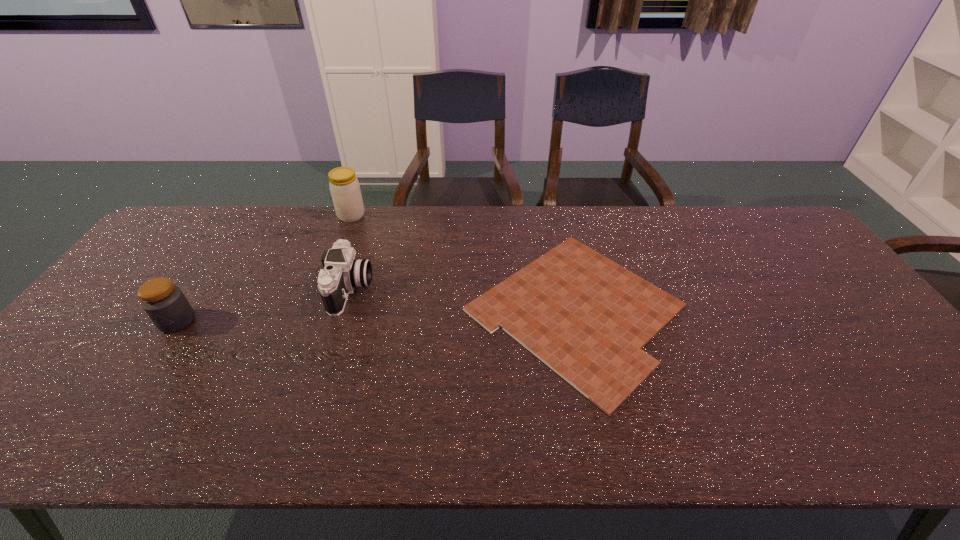
This screenshot has height=540, width=960. In order to click on the farthest object in this screenshot , I will do `click(345, 190)`.

Where is `the right jar`? The height and width of the screenshot is (540, 960). the right jar is located at coordinates (345, 190).

Locate an element on the screen. This screenshot has height=540, width=960. camera is located at coordinates (342, 273).

The height and width of the screenshot is (540, 960). In order to click on the leftmost object in this screenshot , I will do `click(166, 305)`.

You are a GUI agent. You are given a task and a screenshot of the screen. Output one action in this format:
    pyautogui.click(x=<x>, y=<y>)
    Task: Click on the nearer jar
    The width and height of the screenshot is (960, 540).
    Given the screenshot: What is the action you would take?
    pyautogui.click(x=166, y=305)

You are a GUI agent. You are given a task and a screenshot of the screen. Output one action in this format:
    pyautogui.click(x=<x>, y=<y>)
    Task: Click on the gameboard
    The height and width of the screenshot is (540, 960).
    Given the screenshot: What is the action you would take?
    pyautogui.click(x=586, y=317)

Where is `the shortest object`? the shortest object is located at coordinates (586, 317).

Locate an element on the screen. The width and height of the screenshot is (960, 540). vacant space located 0.200m on the front of the tallest object is located at coordinates (334, 262).

Where is `vacant region located 0.170m on the right of the camera`? The width and height of the screenshot is (960, 540). vacant region located 0.170m on the right of the camera is located at coordinates (430, 289).

Identify the location of free space located 0.100m on the surface of the nearer jar near the warning symbol. The width and height of the screenshot is (960, 540). (147, 367).